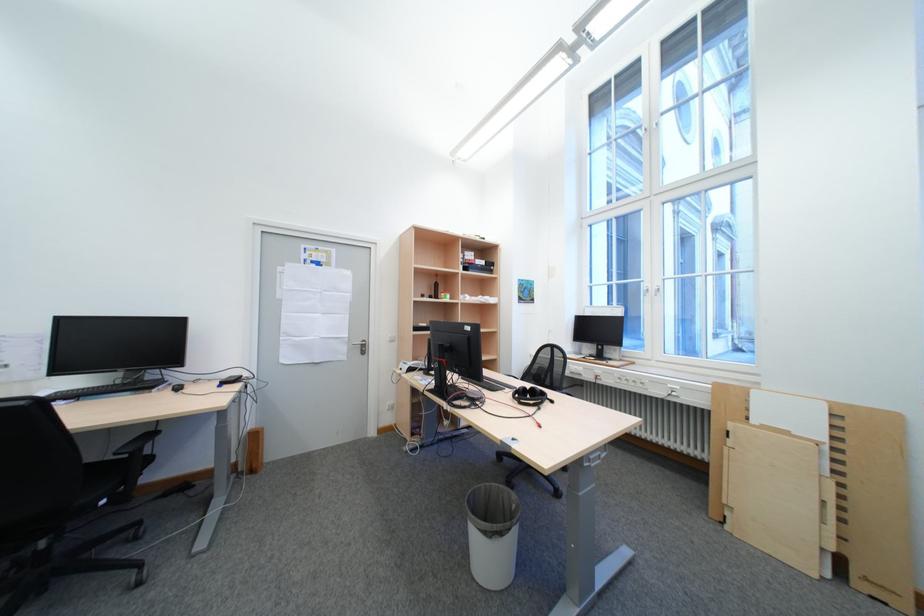
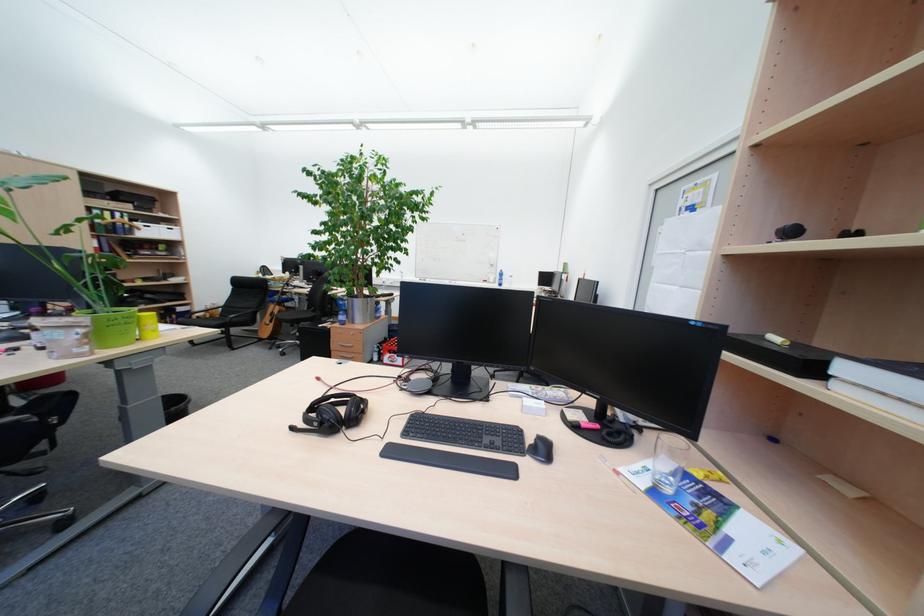
Question: I am providing you with two images of the same scene from different viewpoints. After the viewpoint changes to image2, which objects are now occluded?

Choices:
 (A) grey trash can
 (B) chair armrest
 (C) black headphone set
 (D) orange whiteboard eraser

Answer: (A)